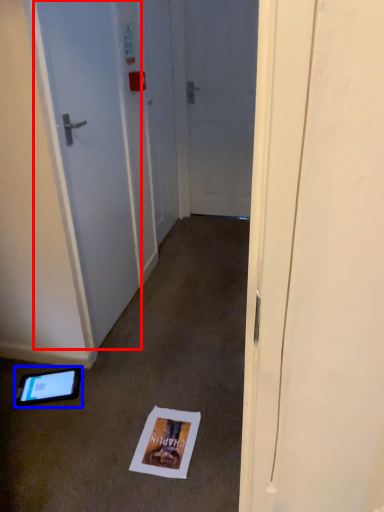
Question: Which object is further to the camera taking this photo, door (highlighted by a red box) or tablet computer (highlighted by a blue box)?

Choices:
 (A) door
 (B) tablet computer

Answer: (B)